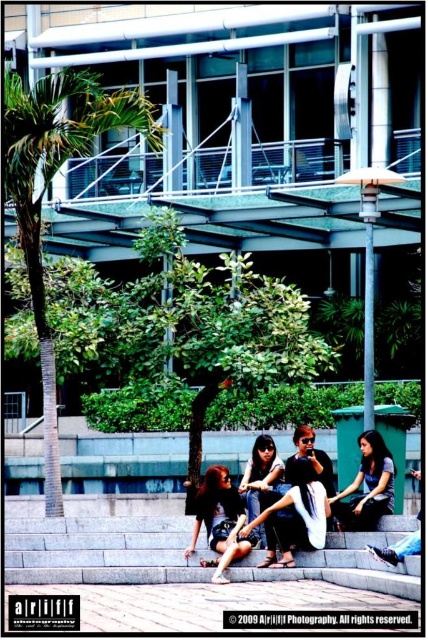
Question: Is denim shorts at center in front of matte black jacket at lower right?

Choices:
 (A) yes
 (B) no

Answer: (A)

Question: Can you confirm if green leafy palm tree at left is positioned above denim shorts at center?

Choices:
 (A) no
 (B) yes

Answer: (B)

Question: Considering the real-world distances, which object is closest to the matte black hair at center?

Choices:
 (A) matte black laptop at center
 (B) denim shorts at center
 (C) green leafy palm tree at left

Answer: (B)

Question: Which of the following is the closest to the observer?

Choices:
 (A) green leafy palm tree at left
 (B) matte black laptop at center
 (C) matte black jacket at lower right

Answer: (B)

Question: Is green leafy palm tree at left behind matte black laptop at center?

Choices:
 (A) no
 (B) yes

Answer: (B)

Question: Which of the following is the closest to the observer?

Choices:
 (A) matte black laptop at center
 (B) green leafy palm tree at left
 (C) denim shorts at center

Answer: (C)